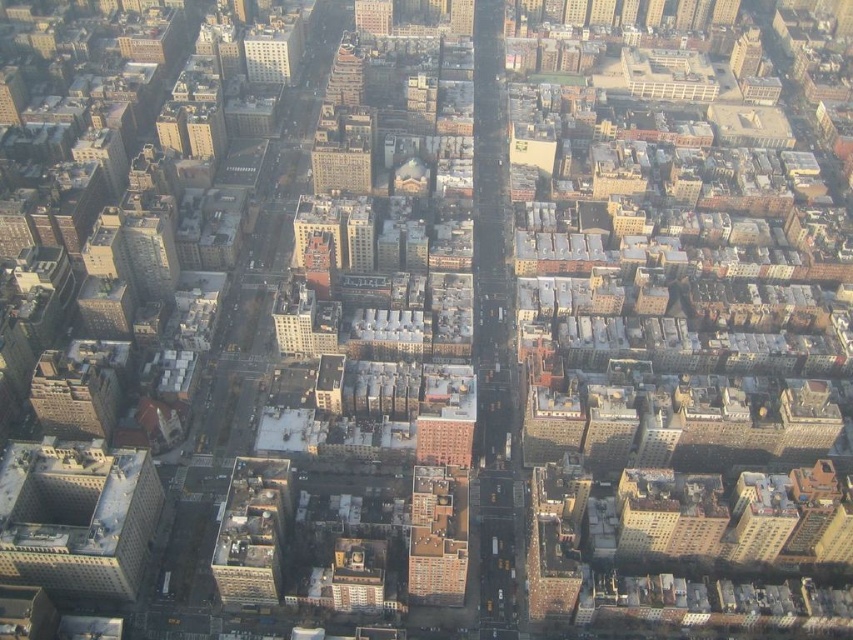
Question: Does matte gray building at center appear over brown brick building at center?

Choices:
 (A) no
 (B) yes

Answer: (A)

Question: Does matte gray building at center come in front of brown brick building at center?

Choices:
 (A) yes
 (B) no

Answer: (A)

Question: Which of these objects is positioned closest to the matte gray building at upper center?

Choices:
 (A) brown brick building at center
 (B) gray concrete building at lower left

Answer: (A)

Question: Does matte gray building at center appear on the left side of matte gray building at upper center?

Choices:
 (A) no
 (B) yes

Answer: (A)

Question: Which point appears farthest from the camera in this image?

Choices:
 (A) (51, 557)
 (B) (254, 32)
 (C) (346, 163)
 (D) (276, 509)

Answer: (B)

Question: Based on their relative distances, which object is farther from the gray concrete building at lower left?

Choices:
 (A) brown brick building at center
 (B) matte gray building at upper center

Answer: (B)